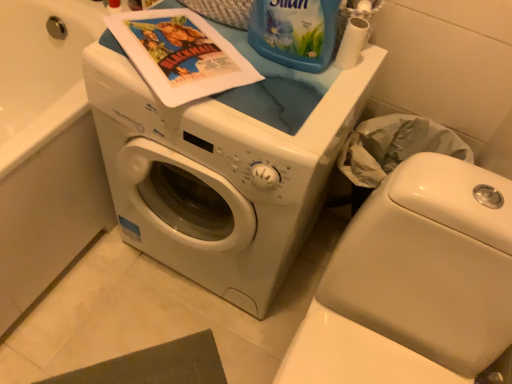
Find the location of `free space in front of blue plastic bottle at upper center`. free space in front of blue plastic bottle at upper center is located at coordinates pos(280,102).